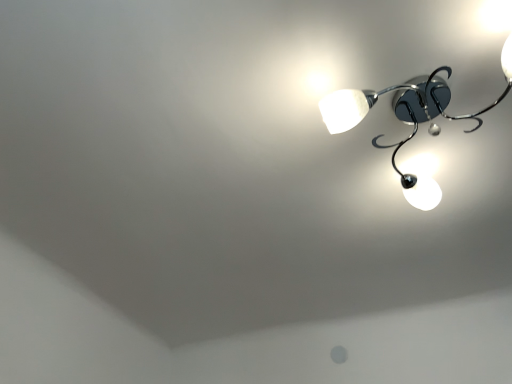
Question: Should I look upward or downward to see metallic chrome chandelier at upper right?

Choices:
 (A) up
 (B) down

Answer: (A)